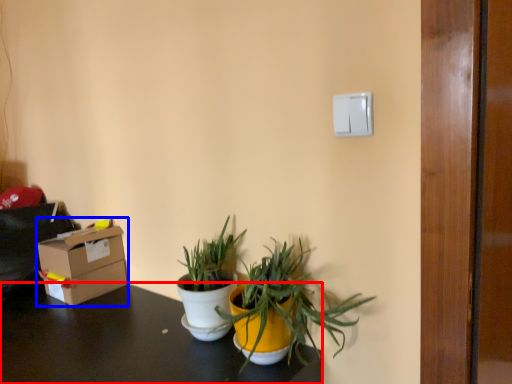
Question: Which object appears closest to the camera in this image, desk (highlighted by a red box) or box (highlighted by a blue box)?

Choices:
 (A) desk
 (B) box

Answer: (A)